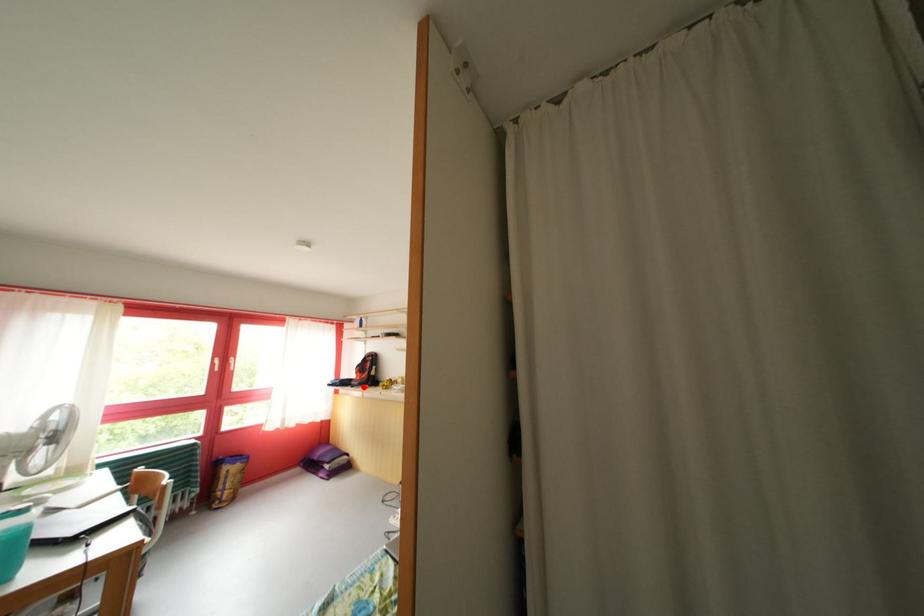
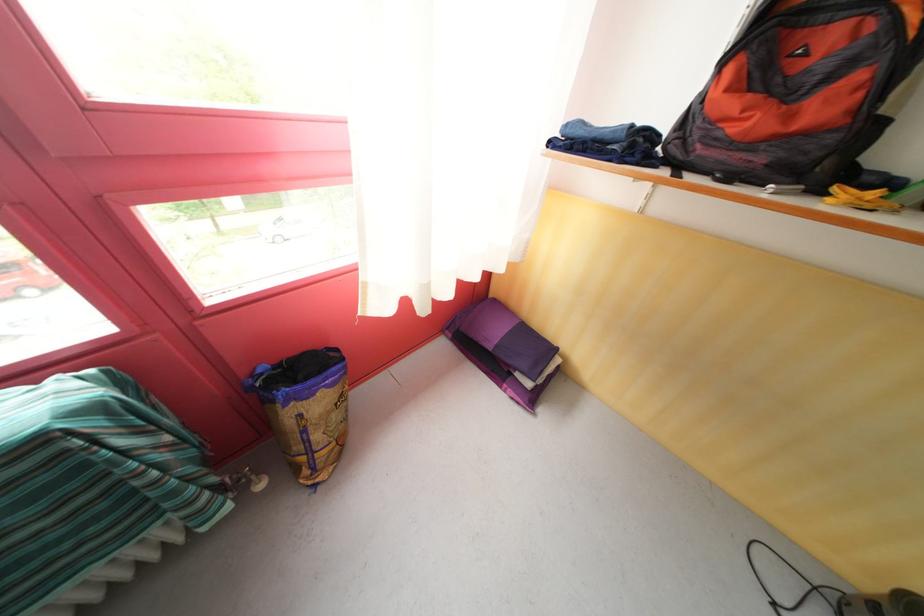
Question: A red point is marked in image1. In image2, is the corresponding 3D point closer to the camera or farther? Reply with the corresponding letter.

Choices:
 (A) The corresponding 3D point is closer.
 (B) The corresponding 3D point is farther.

Answer: (A)